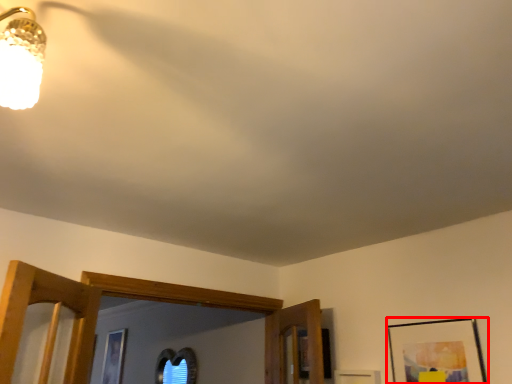
Question: From the image's perspective, considering the relative positions of picture frame (annotated by the red box) and picture in the image provided, where is picture frame (annotated by the red box) located with respect to the staircase?

Choices:
 (A) above
 (B) below

Answer: (A)